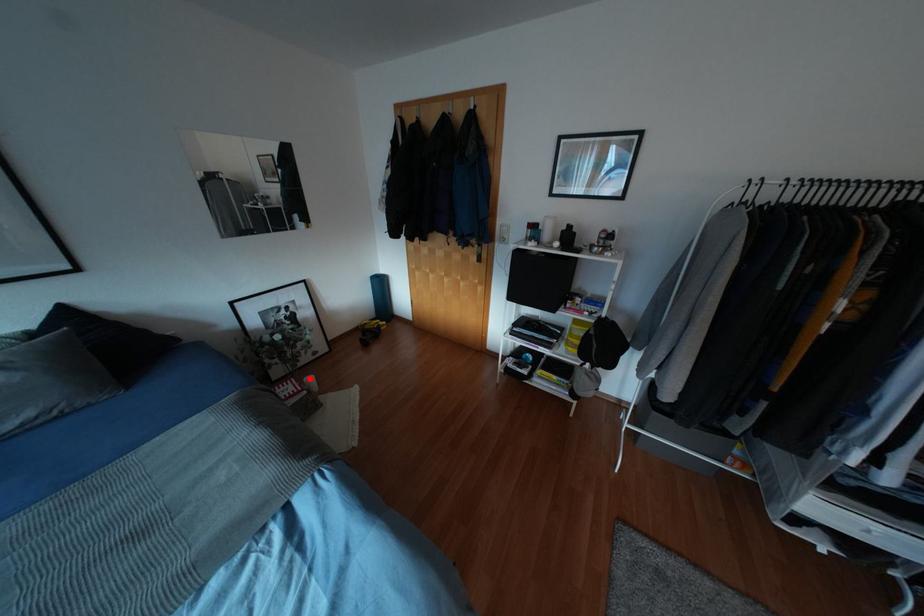
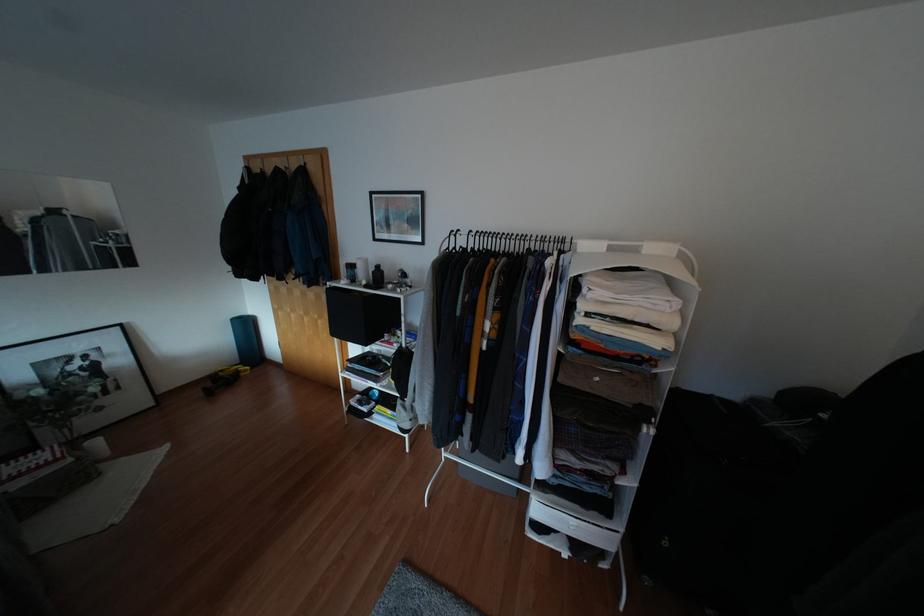
Question: I am providing you with two images of the same scene from different viewpoints. Given a red point in image1, look at the same physical point in image2. Is it:

Choices:
 (A) Closer to the viewpoint
 (B) Farther from the viewpoint

Answer: (B)